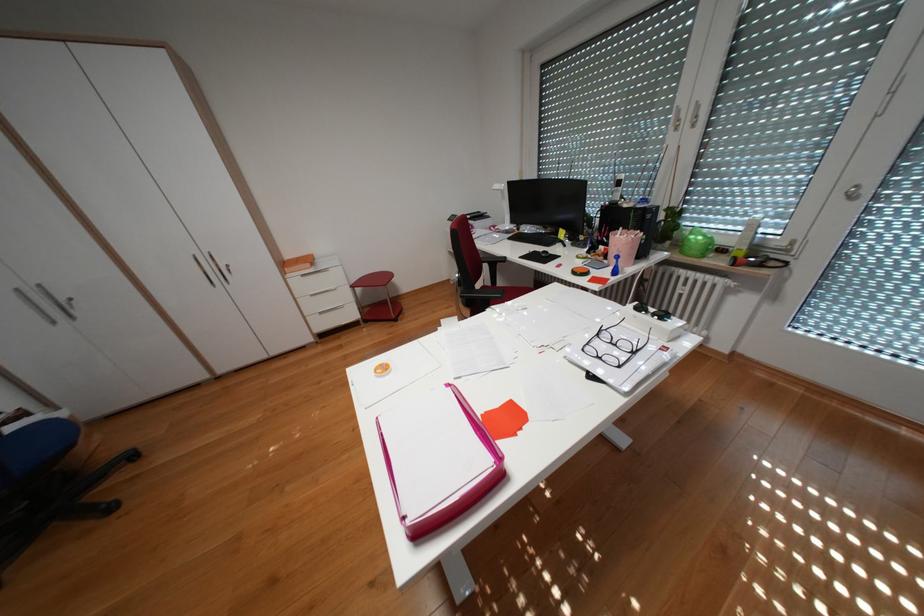
Find where to lift the green apple container. Please return your answer as a coordinate pair (x, y).

(696, 243)